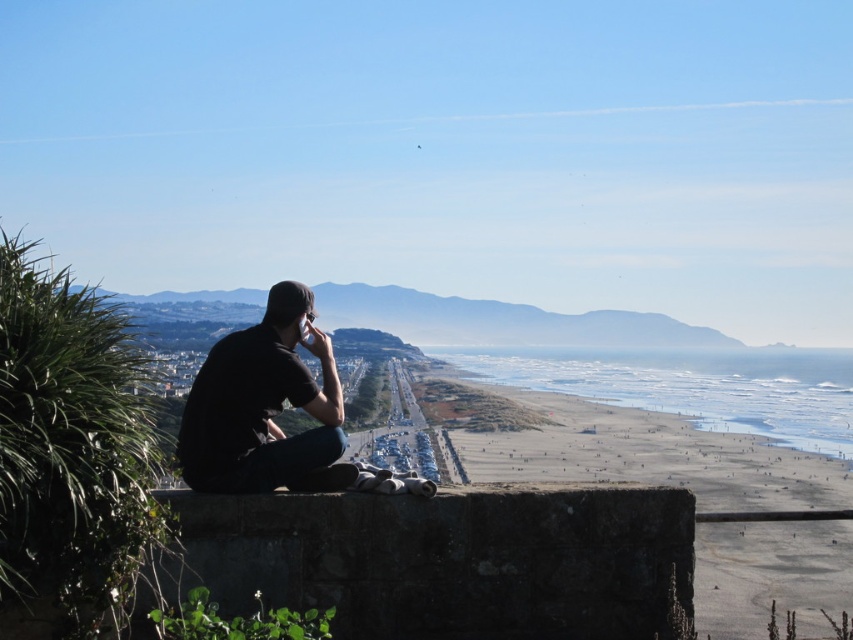
Which of these two, smooth sand beach at center or black matte shirt at left, stands taller?

Standing taller between the two is smooth sand beach at center.

Does point (682, 465) lie behind point (329, 480)?

Yes, point (682, 465) is behind point (329, 480).

Image resolution: width=853 pixels, height=640 pixels. Identify the location of smooth sand beach at center. (647, 452).